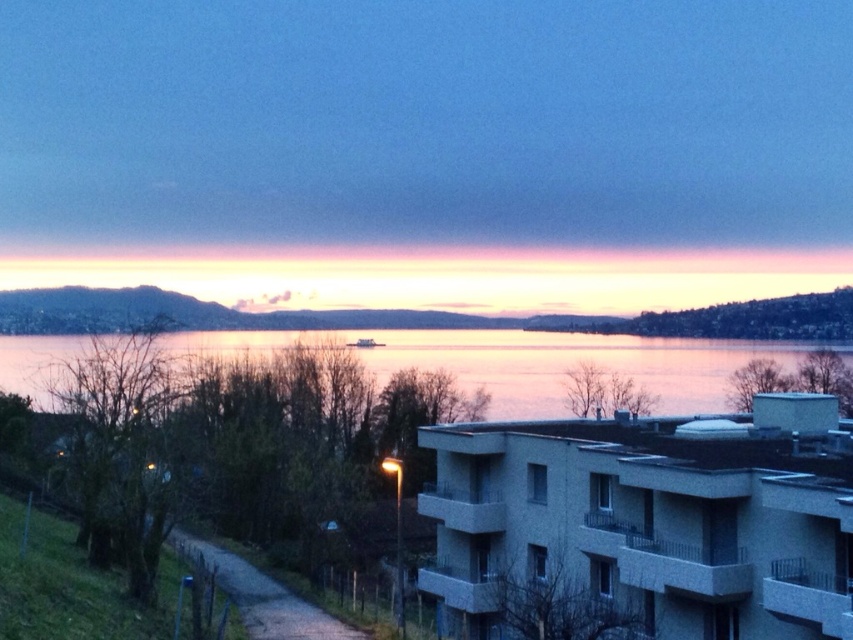
Question: Observing the image, what is the correct spatial positioning of silvery reflective water at center in reference to dirt/gravel path at lower left?

Choices:
 (A) below
 (B) above

Answer: (B)

Question: Which point appears farthest from the camera in this image?

Choices:
 (A) (323, 628)
 (B) (675, 371)

Answer: (B)

Question: Among these objects, which one is farthest from the camera?

Choices:
 (A) silvery reflective water at center
 (B) dirt/gravel path at lower left

Answer: (A)

Question: Which object is closer to the camera taking this photo?

Choices:
 (A) silvery reflective water at center
 (B) dirt/gravel path at lower left

Answer: (B)

Question: In this image, where is silvery reflective water at center located relative to dirt/gravel path at lower left?

Choices:
 (A) below
 (B) above

Answer: (B)

Question: Is silvery reflective water at center above dirt/gravel path at lower left?

Choices:
 (A) yes
 (B) no

Answer: (A)